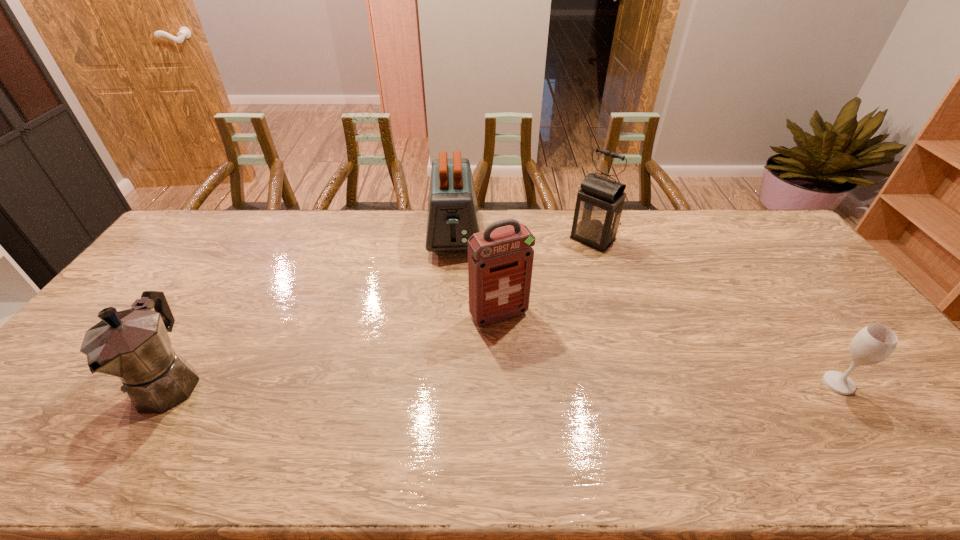
Locate an element on the screen. The image size is (960, 540). free space between the fourth object from left to right and the coffeepot is located at coordinates (382, 311).

Where is `vacant space in between the coffeepot and the toaster`? The width and height of the screenshot is (960, 540). vacant space in between the coffeepot and the toaster is located at coordinates (312, 308).

Identify the location of free space between the lantern and the leftmost object. (382, 311).

Where is `vacant space that's between the leftmost object and the toaster`? This screenshot has width=960, height=540. vacant space that's between the leftmost object and the toaster is located at coordinates (312, 308).

The image size is (960, 540). In order to click on free space between the fourth object from left to right and the third nearest object in this screenshot , I will do `click(546, 277)`.

What are the coordinates of `free space between the leftmost object and the toaster` in the screenshot? It's located at (312, 308).

This screenshot has width=960, height=540. What are the coordinates of `blank region between the rightmost object and the first-aid kit` in the screenshot? It's located at (668, 349).

Identify the location of object that is the third closest to the toaster. (133, 345).

Locate an element on the screen. The height and width of the screenshot is (540, 960). object that is the nearest to the fourth object from left to right is located at coordinates (500, 260).

Where is `vacant region that satisfies the following two spatial constraints: 1. on the pouring side of the coffeepot; 2. on the right side of the wineglass`? vacant region that satisfies the following two spatial constraints: 1. on the pouring side of the coffeepot; 2. on the right side of the wineglass is located at coordinates (169, 383).